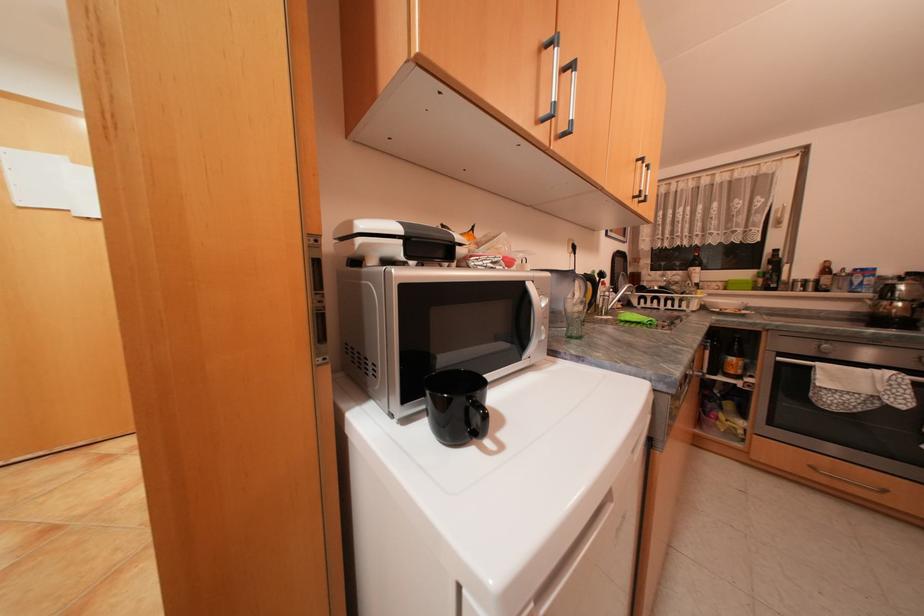
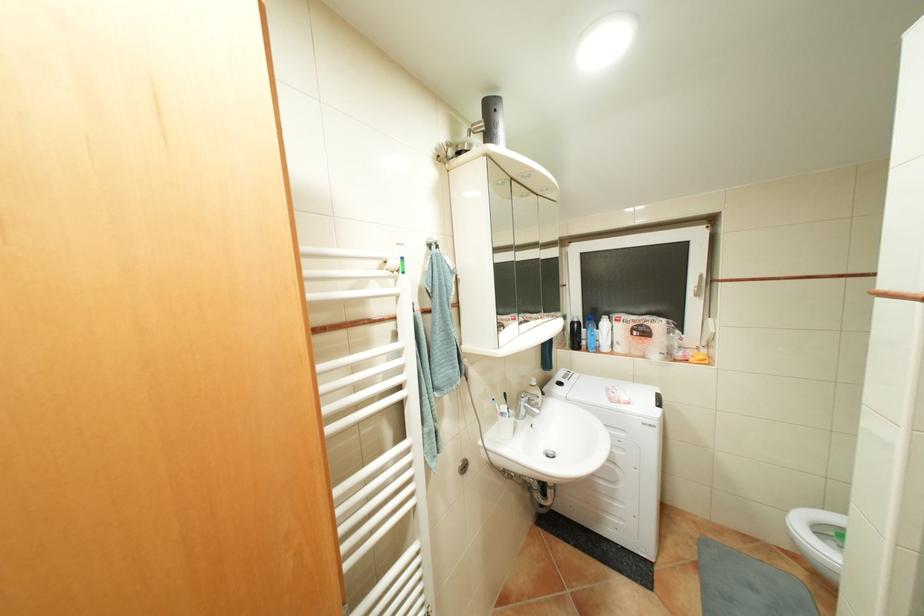
Which direction would the cameraman need to move to produce the second image?

The movement direction of the cameraman is left, forward.